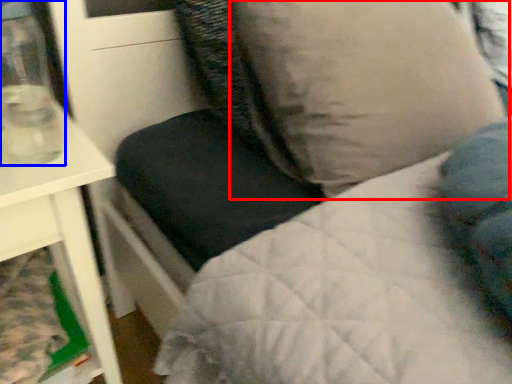
Question: Which of the following is the farthest to the observer, pillow (highlighted by a red box) or glass vase (highlighted by a blue box)?

Choices:
 (A) pillow
 (B) glass vase

Answer: (A)